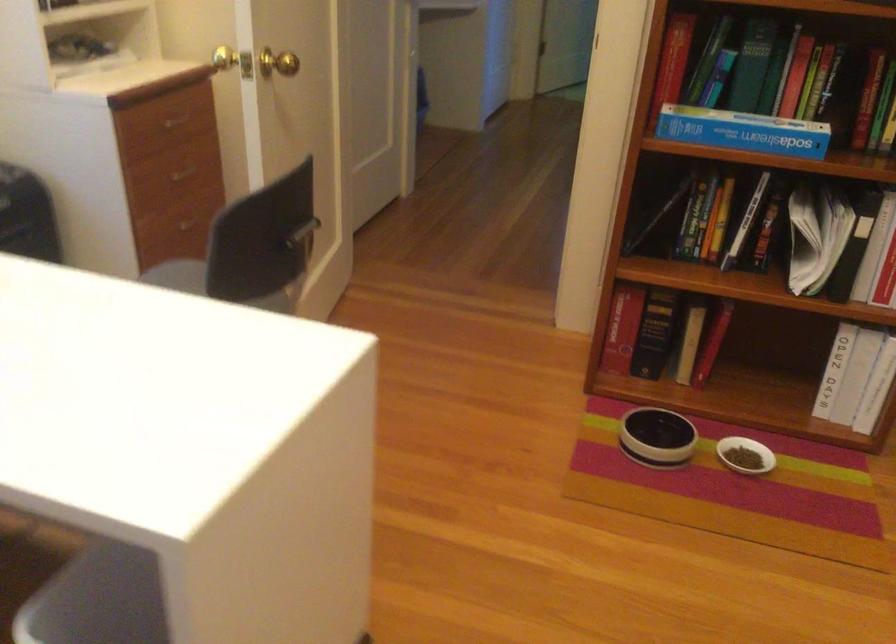
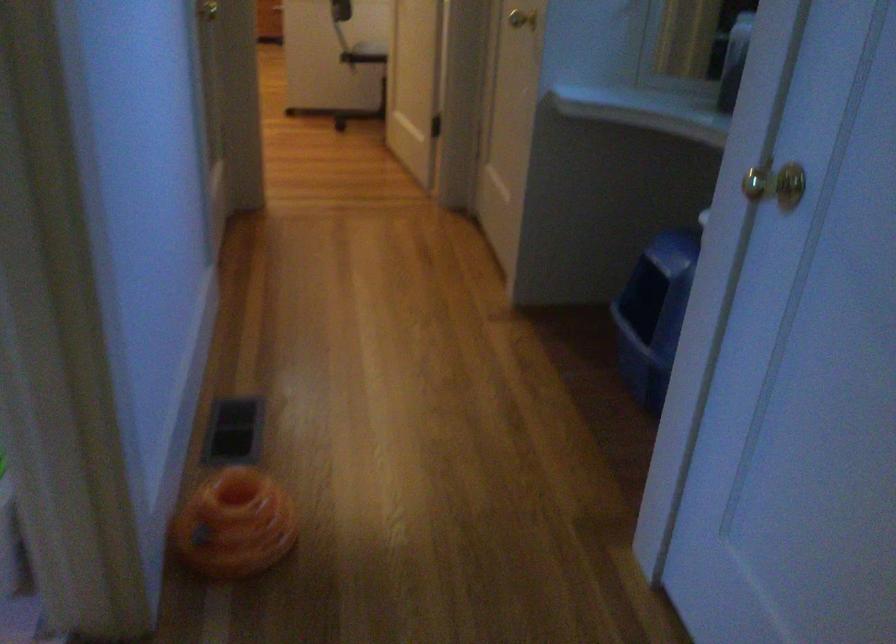
Find the pixel in the second image that matches pixel 265 296 in the first image.

(371, 49)